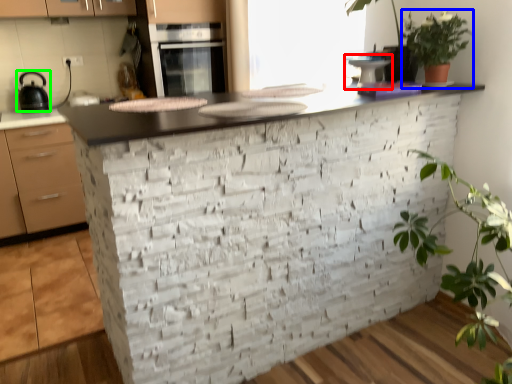
Question: Based on their relative distances, which object is farther from appliance (highlighted by a red box)? Choose from vegetation (highlighted by a blue box) and kitchen appliance (highlighted by a green box).

Choices:
 (A) vegetation
 (B) kitchen appliance

Answer: (B)